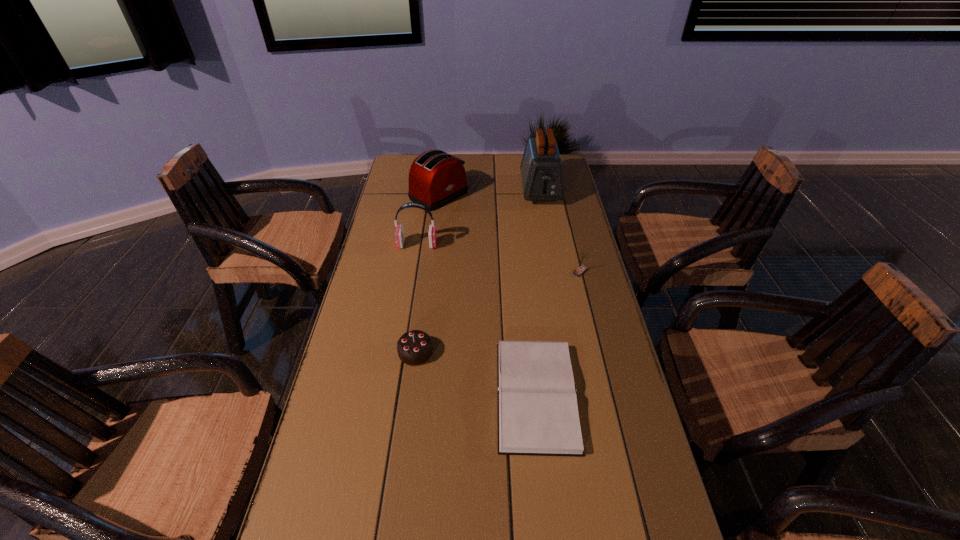
The width and height of the screenshot is (960, 540). In order to click on free space between the shortest object and the second shortest object in this screenshot , I will do `click(476, 374)`.

Find the location of `free spot between the shortest object and the third nearest object`. free spot between the shortest object and the third nearest object is located at coordinates (558, 334).

Locate an element on the screen. The width and height of the screenshot is (960, 540). vacant area that lies between the shortest object and the tallest object is located at coordinates (539, 293).

This screenshot has width=960, height=540. What are the coordinates of `free spot between the tallest object and the hardback book` in the screenshot? It's located at (539, 293).

Locate an element on the screen. free space between the third nearest object and the shortest object is located at coordinates (558, 334).

Find the location of `the second closest object relative to the shortest object`. the second closest object relative to the shortest object is located at coordinates (581, 269).

This screenshot has width=960, height=540. What are the coordinates of `object that is the fourth closest to the right toaster` in the screenshot? It's located at (538, 414).

This screenshot has height=540, width=960. I want to click on free space in the image that satisfies the following two spatial constraints: 1. on the outer surface of the earphone; 2. on the back side of the chocolate cake, so click(x=399, y=352).

You are a GUI agent. You are given a task and a screenshot of the screen. Output one action in this format:
    pyautogui.click(x=<x>, y=<y>)
    Task: Click on the vacant space that satisfies the following two spatial constraints: 1. on the outer surface of the shortest object; 2. on the left side of the fourth nearest object
    The width and height of the screenshot is (960, 540).
    Given the screenshot: What is the action you would take?
    pyautogui.click(x=393, y=395)

I want to click on free location that satisfies the following two spatial constraints: 1. on the outer surface of the fourth nearest object; 2. on the right side of the shortest object, so click(393, 395).